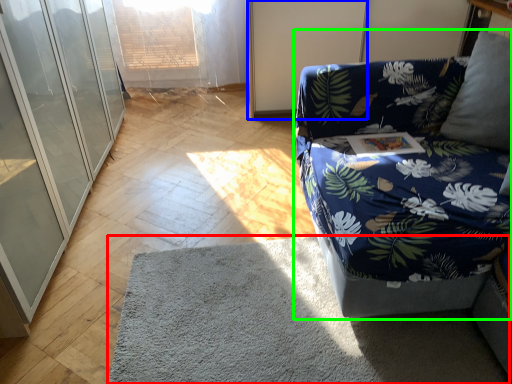
Question: Which object is positioned closest to mat (highlighted by a red box)? Select from screen door (highlighted by a blue box) and studio couch (highlighted by a green box).

Choices:
 (A) screen door
 (B) studio couch

Answer: (B)